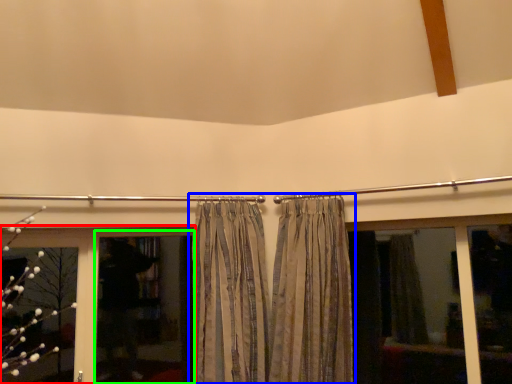
Question: Based on their relative distances, which object is nearer to bay window (highlighted by a red box)? Choose from curtain (highlighted by a blue box) and screen door (highlighted by a green box).

Choices:
 (A) curtain
 (B) screen door

Answer: (B)